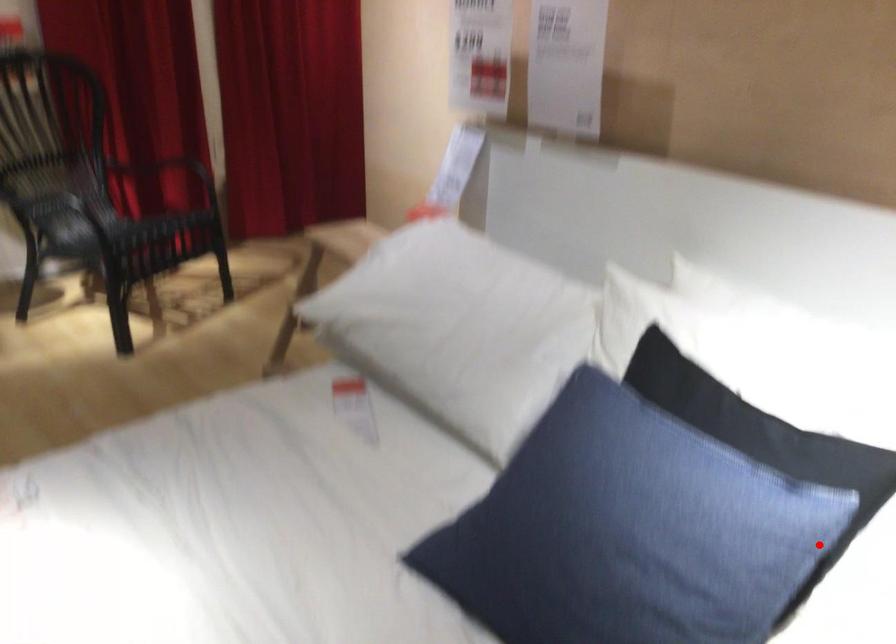
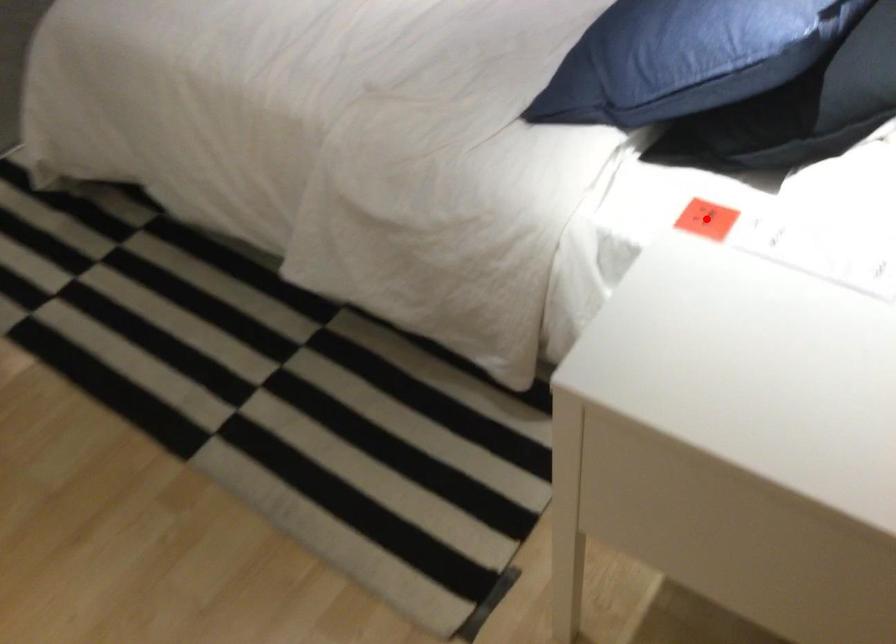
I am providing you with two images of the same scene from different viewpoints. A red point is marked on the first image and another point is marked on the second image. Are the points marked in image1 and image2 representing the same 3D position?

No